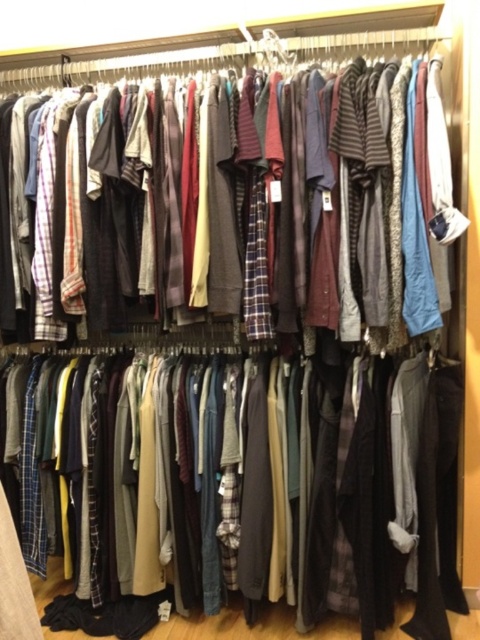
You are organizing the closet and need to retrieve an item from behind. You see the dark gray sweater at center and the plaid fabric shirts at center. Which item will you need to move first to access the one behind it?

The dark gray sweater at center is further to the viewer than the plaid fabric shirts at center, so you need to move the dark gray sweater at center first to access the plaid fabric shirts at center.

You are standing in front of the closet and want to reach the dark gray sweater at center. If your arm can extend 5 feet, can you grab it without moving closer?

The dark gray sweater at center is 6.12 feet away from you, which is beyond your arm reach of 5 feet. You need to move closer to grab it.

You are organizing a closet and need to place a new item between the dark gray sweater at center and the plaid fabric shirts at center. The new item is 30 centimeters wide. Is there enough space between them to fit it without overlapping?

The dark gray sweater at center is 50.97 centimeters away from the plaid fabric shirts at center. Since the new item is 30 centimeters wide, there is enough space between them to fit it without overlapping.